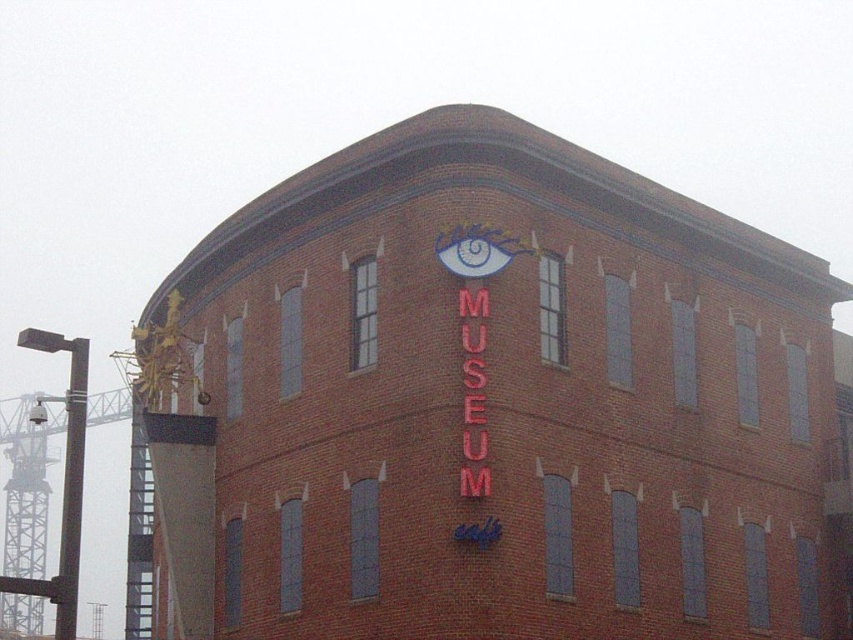
You are standing directly in front of the brick building. Where is the red neon sign at upper center located relative to your position?

The red neon sign at upper center is located at the upper center of the brick building, which is directly in front of you.

You are standing in front of the brick building and want to take a photo of both the red neon sign at upper center and the red neon sign at center. However, you notice that one of them is partially hidden. Which neon sign is blocking the other?

The red neon sign at upper center is in front of the red neon sign at center, so the upper center sign is blocking the center sign.